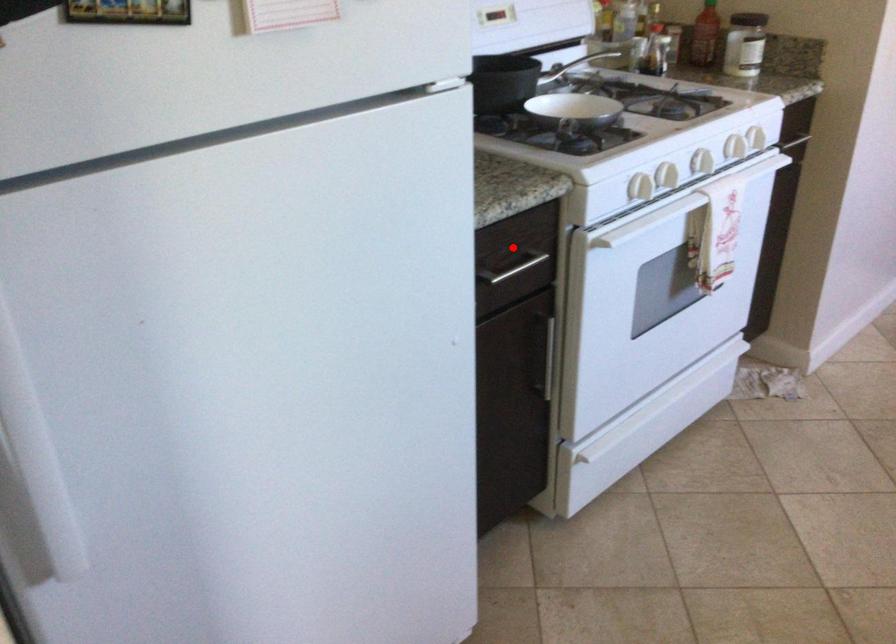
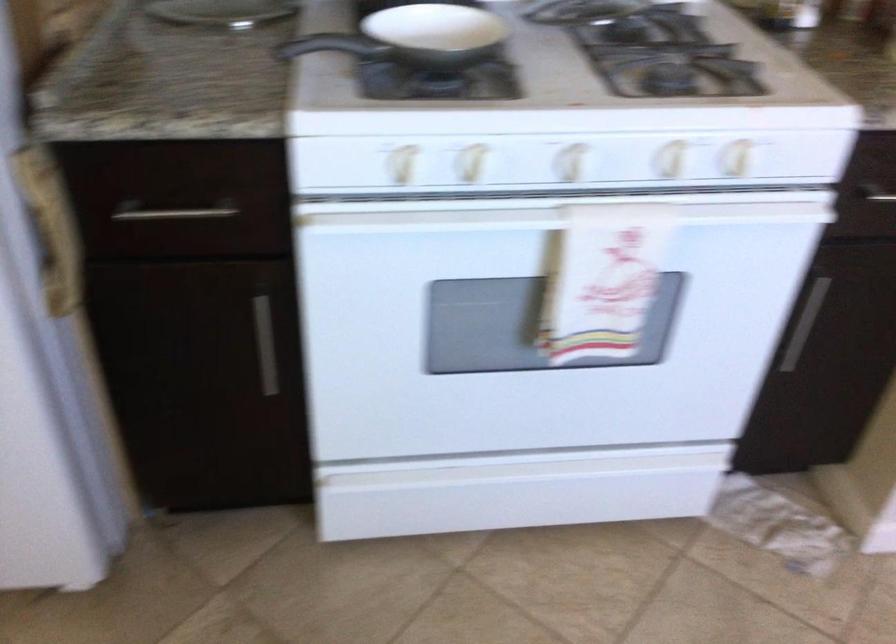
In the second image, find the point that corresponds to the highlighted location in the first image.

(173, 213)